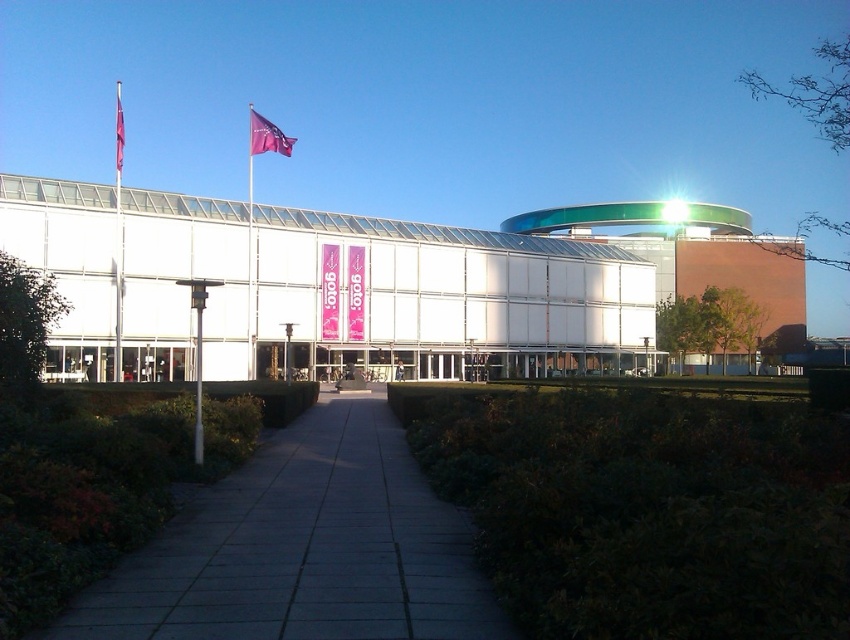
Looking at this image, you are a visitor approaching the building and want to take a photo of the metallic flag pole at left and the purple fabric flag at upper left. Which one will appear larger in your camera viewfinder?

The metallic flag pole at left appears larger in the camera viewfinder because it is much taller than the purple fabric flag at upper left.

Consider the image. You are a visitor approaching the building and notice the metallic flag pole at left and the purple fabric flag at upper left. Which object is positioned higher relative to the other?

The purple fabric flag at upper left is positioned higher than the metallic flag pole at left as it is located above it.